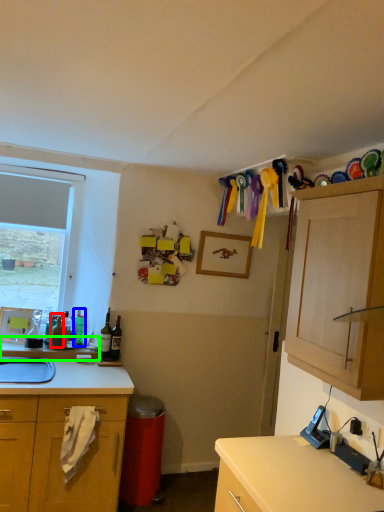
Question: Which object is positioned closest to bottle (highlighted by a red box)? Select from bottle (highlighted by a blue box) and countertop (highlighted by a green box).

Choices:
 (A) bottle
 (B) countertop

Answer: (A)